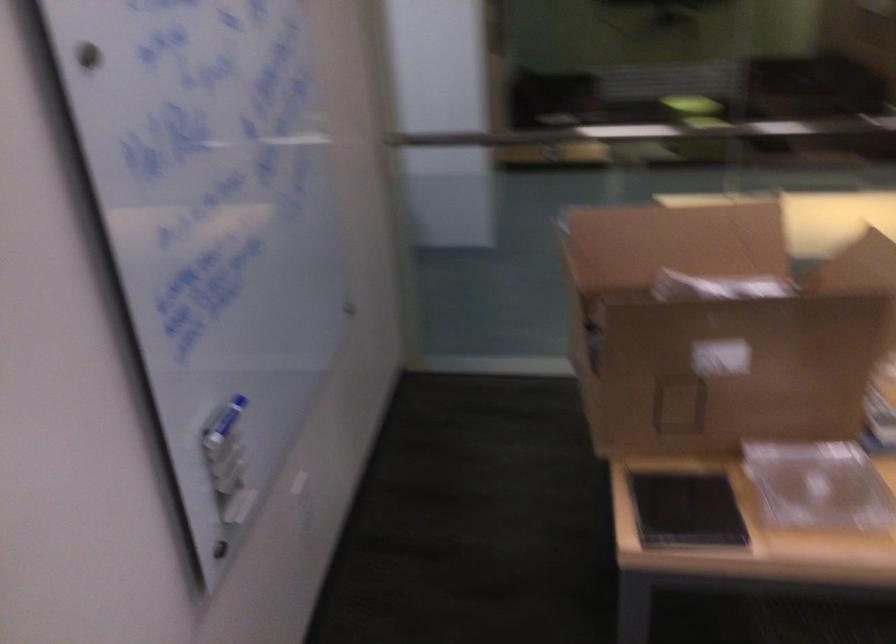
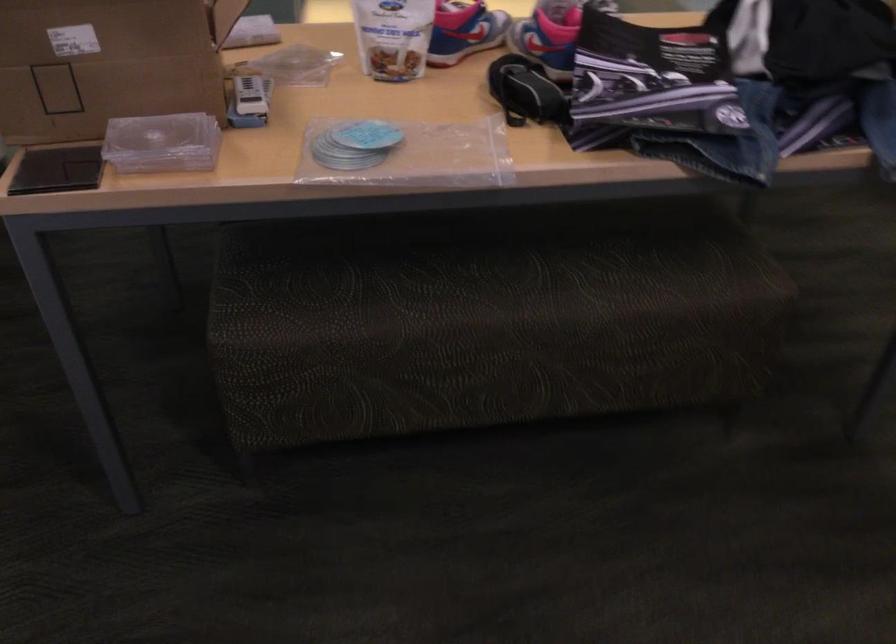
Find the pixel in the second image that matches point (737, 462) in the first image.

(149, 134)